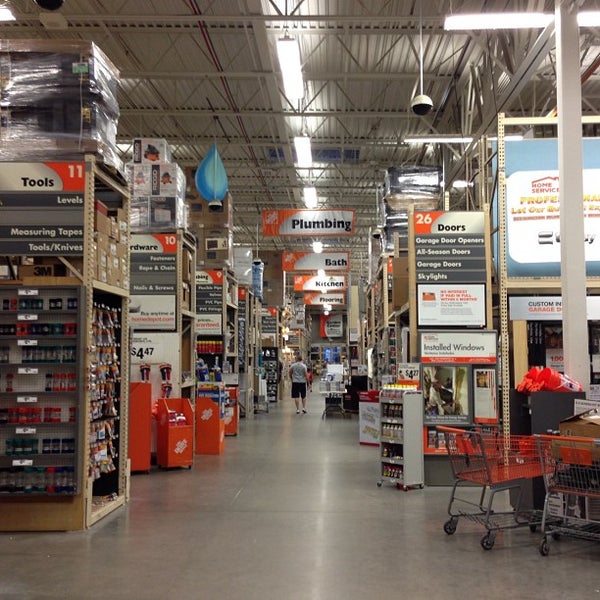
I want to click on lights, so click(x=316, y=243), click(x=323, y=292).